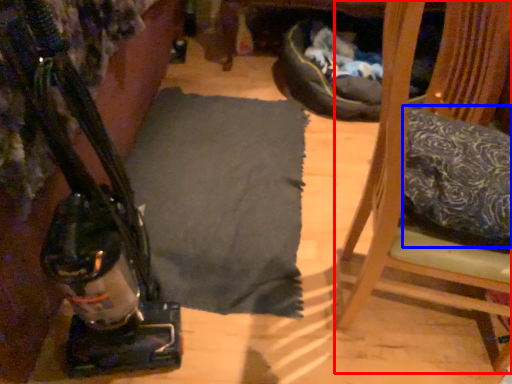
Question: Which object is further to the camera taking this photo, furniture (highlighted by a red box) or pillow (highlighted by a blue box)?

Choices:
 (A) furniture
 (B) pillow

Answer: (B)